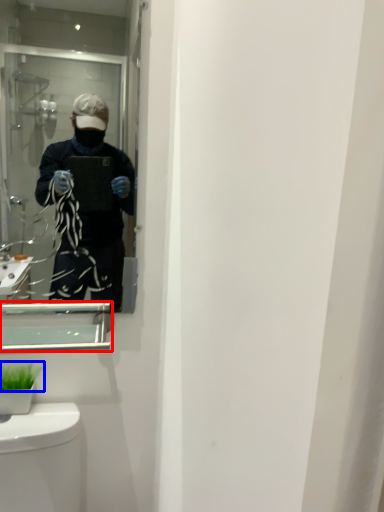
Question: Among these objects, which one is nearest to the camera, medicine cabinet (highlighted by a red box) or plant (highlighted by a blue box)?

Choices:
 (A) medicine cabinet
 (B) plant

Answer: (A)